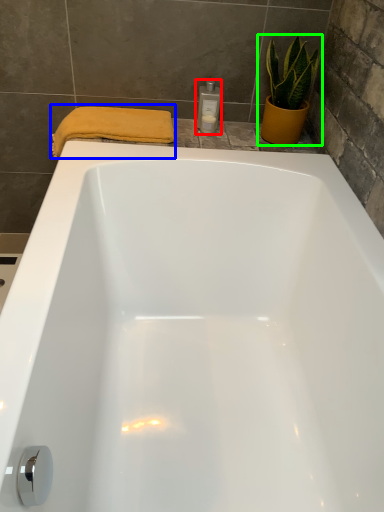
Question: Estimate the real-world distances between objects in this image. Which object is closer to toiletry (highlighted by a red box), bath towel (highlighted by a blue box) or houseplant (highlighted by a green box)?

Choices:
 (A) bath towel
 (B) houseplant

Answer: (B)